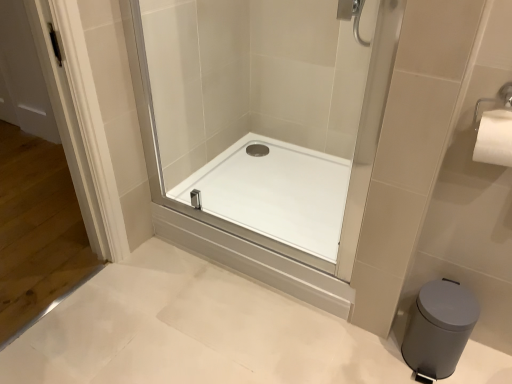
Question: From a real-world perspective, relative to gray matte trash can at lower right, is transparent glass shower door at center vertically above or below?

Choices:
 (A) below
 (B) above

Answer: (B)

Question: From the image's perspective, is transparent glass shower door at center located above or below gray matte trash can at lower right?

Choices:
 (A) above
 (B) below

Answer: (A)

Question: Which is nearer to the transparent glass shower door at center?

Choices:
 (A) gray matte trash can at lower right
 (B) white glossy shower tray at center

Answer: (B)

Question: Estimate the real-world distances between objects in this image. Which object is farther from the transparent glass shower door at center?

Choices:
 (A) white glossy shower tray at center
 (B) gray matte trash can at lower right

Answer: (B)